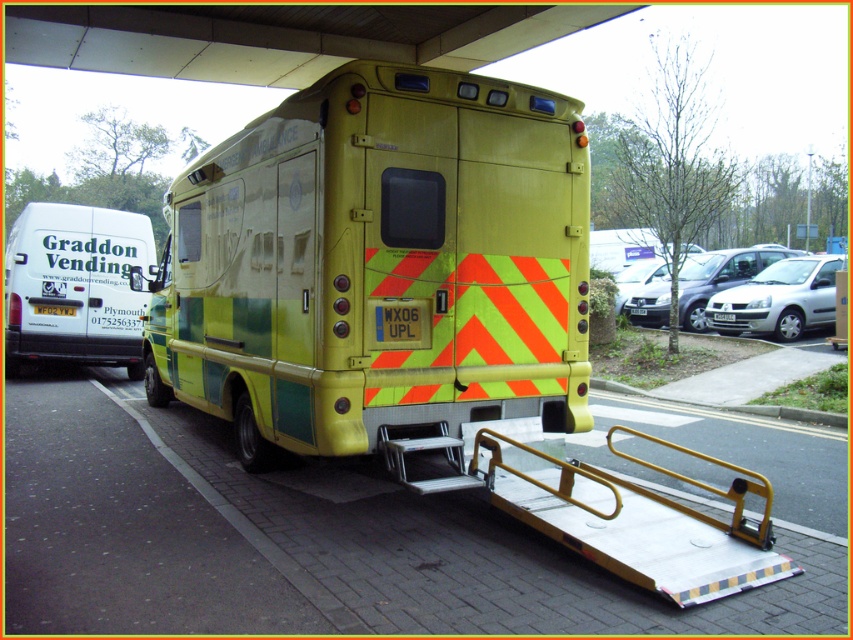
Question: Which point is farther from the camera taking this photo?

Choices:
 (A) (773, 296)
 (B) (711, 272)

Answer: (B)

Question: Which is farther from the yellow reflective plate at rear?

Choices:
 (A) yellow/green metallic van at center
 (B) white metallic car at right
 (C) silver metallic car at center

Answer: (A)

Question: Is yellow/green metallic van at center bigger than yellow plastic license plate at rear?

Choices:
 (A) yes
 (B) no

Answer: (A)

Question: Which object appears closest to the camera in this image?

Choices:
 (A) yellow reflective plate at rear
 (B) yellow plastic license plate at rear
 (C) silver metallic car at center
 (D) yellow/green painted ambulance at center

Answer: (D)

Question: Can you confirm if yellow matte license plate at rear is positioned below yellow plastic license plate at rear?

Choices:
 (A) no
 (B) yes

Answer: (A)

Question: Is yellow/green metallic van at center bigger than yellow reflective plate at rear?

Choices:
 (A) no
 (B) yes

Answer: (B)